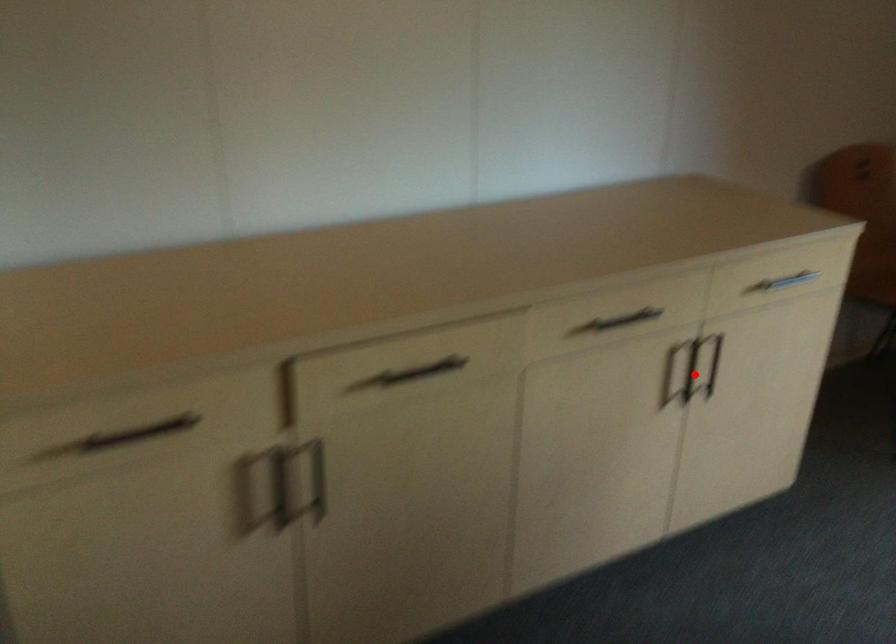
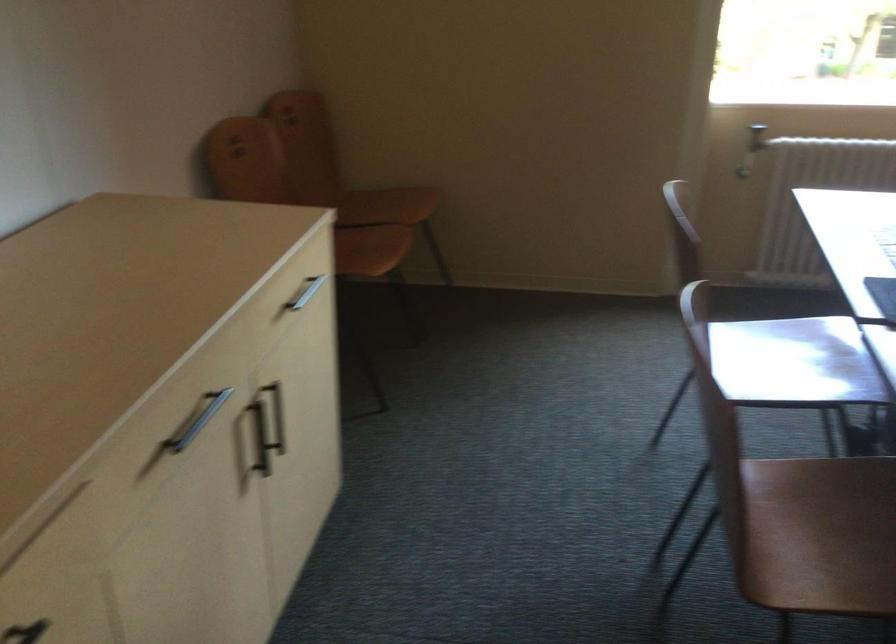
In the second image, find the point that corresponds to the highlighted location in the first image.

(260, 438)